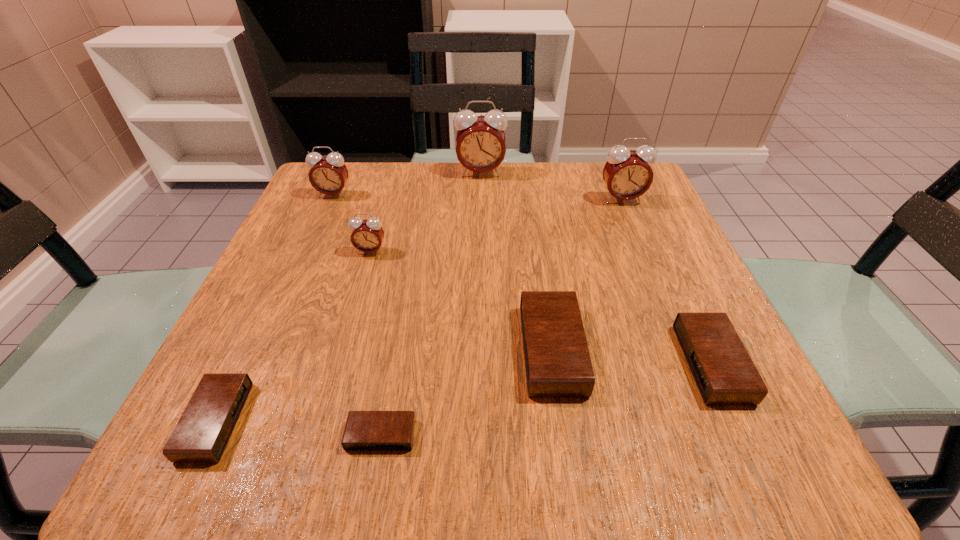
You are a GUI agent. You are given a task and a screenshot of the screen. Output one action in this format:
    pyautogui.click(x=<x>, y=<y>)
    Task: Click on the free space at the far edge
    This screenshot has height=540, width=960.
    Given the screenshot: What is the action you would take?
    pyautogui.click(x=530, y=180)

Image resolution: width=960 pixels, height=540 pixels. What are the coordinates of `free space at the near edge` in the screenshot? It's located at (436, 424).

Find the location of a particular element. free space at the left edge is located at coordinates (324, 260).

Locate an element on the screen. The width and height of the screenshot is (960, 540). free space at the right edge is located at coordinates (650, 267).

Where is `vacant space at the far left corner of the desktop`? This screenshot has width=960, height=540. vacant space at the far left corner of the desktop is located at coordinates (319, 200).

Find the location of a particular element. free space at the near left corner of the desktop is located at coordinates (234, 437).

Locate an element on the screen. The width and height of the screenshot is (960, 540). vacant space at the far right corner of the desktop is located at coordinates (653, 213).

In order to click on free space at the near right corner in this screenshot , I will do click(x=764, y=455).

This screenshot has height=540, width=960. I want to click on free point between the farthest pink alarm clock and the third biggest black alarm clock, so click(348, 297).

Find the location of a particular element. This screenshot has width=960, height=540. unoccupied area between the third smallest pink alarm clock and the third smallest black alarm clock is located at coordinates (x=666, y=281).